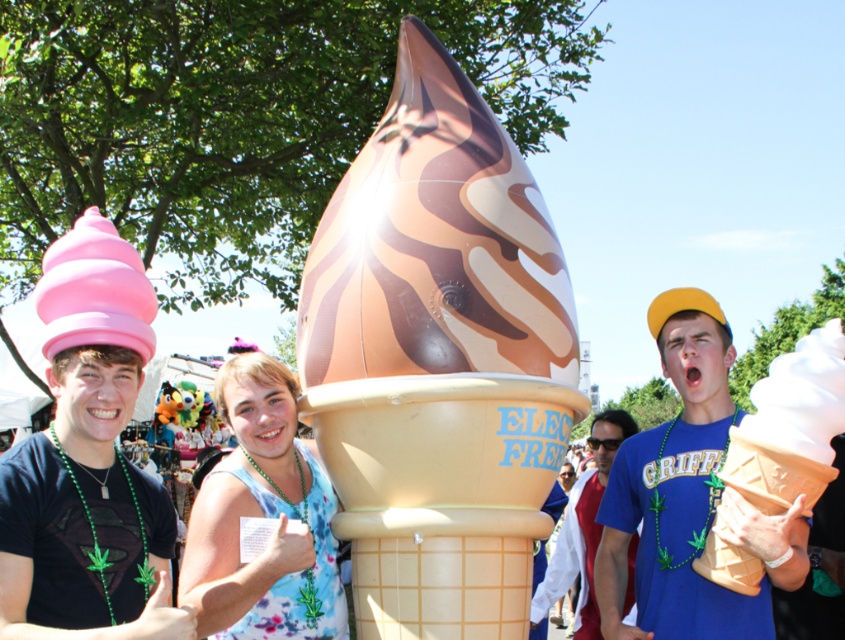
You are organizing a photo shoot and need to place the pink matte ice cream cone at left and the white matte ice cream cone at right in a way that they both fit within a 1.5 meter wide backdrop. Given their sizes, will they fit side by side without overlapping?

The pink matte ice cream cone at left occupies less space than the white matte ice cream cone at right. Since the total width of both objects combined must be less than or equal to 1.5 meters to fit side by side, but without knowing their exact dimensions, it is impossible to determine if they will fit without overlapping. Additional measurements are required.